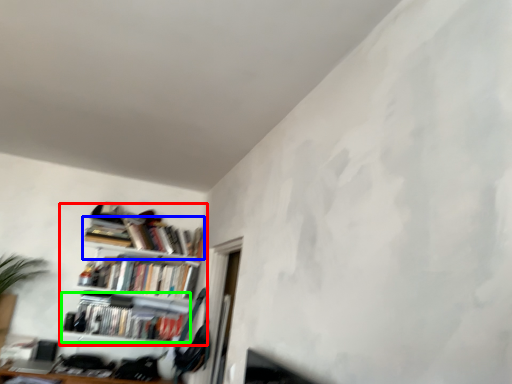
Question: Which is farther away from shelf (highlighted by a red box)? book (highlighted by a blue box) or book (highlighted by a green box)?

Choices:
 (A) book
 (B) book

Answer: (A)